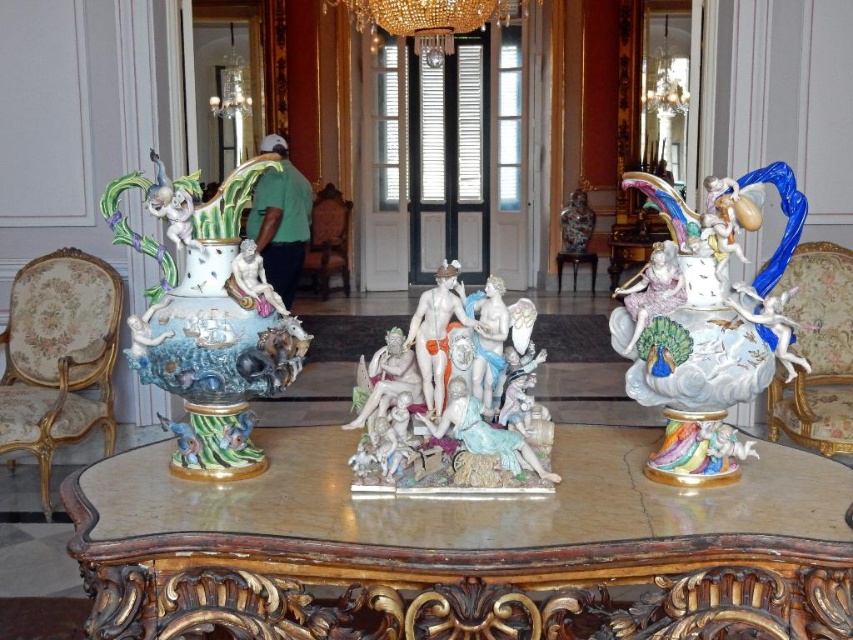
You are an interior designer assessing the space in the image. You need to determine if a new floor lamp that is 1.8 meters tall can be placed on the wooden carved table at center without blocking the view of the porcelain vase at center. Can the lamp be placed there?

The wooden carved table at center is not as tall as the porcelain vase at center, meaning the vase is taller. Since the lamp is 1.8 meters tall, if the table is shorter than the vase, but the lamp needs to be placed on the table, the height of the table itself must be considered. However, without knowing the table height, we can infer that since the vase is taller than the table, placing a 1.8m lamp might exceed the table height, potentially causing instability. However, the question is about blocking the v

You are a photographer standing at the entrance of the room. You want to capture a closeup shot of the porcelain vase with colorful glaze at left without moving any furniture. Can you estimate if you can get a close enough shot given your current position?

The porcelain vase with colorful glaze at left is 6.17 feet away from the camera. Since 6.17 feet is approximately 1.88 meters, which is a reasonable distance for a closeup shot depending on the lens used, it is possible to capture the vase without moving any furniture.